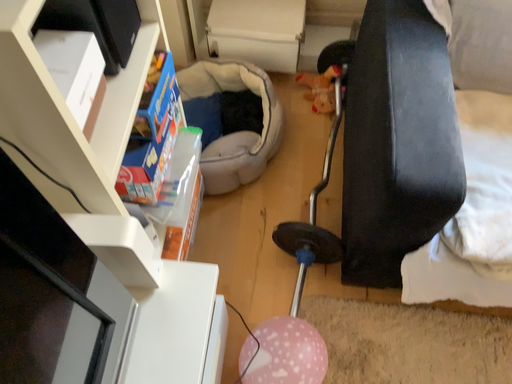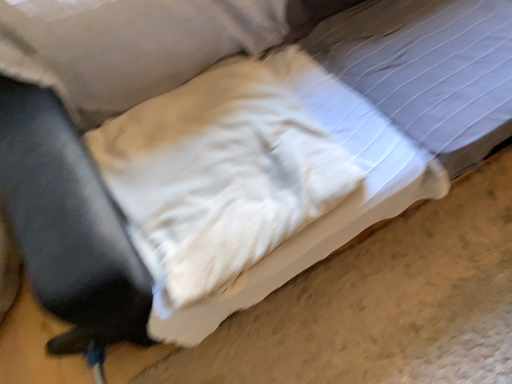
Question: Which way did the camera rotate in the video?

Choices:
 (A) rotated left
 (B) rotated right

Answer: (B)